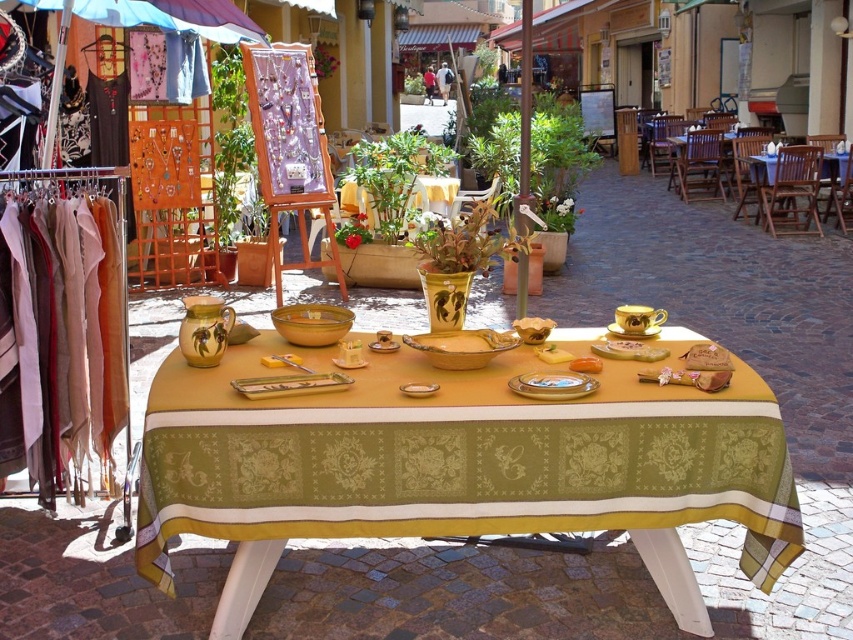
Can you confirm if yellow fabric table at center is positioned to the right of gold metallic platter at center?

In fact, yellow fabric table at center is to the left of gold metallic platter at center.

Can you confirm if yellow fabric table at center is positioned to the left of gold metallic platter at center?

Yes, yellow fabric table at center is to the left of gold metallic platter at center.

Between point (183, 490) and point (508, 380), which one is positioned in front?

Point (183, 490) is more forward.

The image size is (853, 640). Find the location of `yellow fabric table at center`. yellow fabric table at center is located at coordinates (457, 467).

Can you confirm if yellow fabric table at center is shorter than green damask tablecloth at left?

Correct, yellow fabric table at center is not as tall as green damask tablecloth at left.

Is yellow fabric table at center smaller than green damask tablecloth at left?

Actually, yellow fabric table at center might be larger than green damask tablecloth at left.

You are a GUI agent. You are given a task and a screenshot of the screen. Output one action in this format:
    pyautogui.click(x=<x>, y=<y>)
    Task: Click on the yellow fabric table at center
    
    Given the screenshot: What is the action you would take?
    pyautogui.click(x=457, y=467)

Does point (816, 145) lie behind point (590, 388)?

Yes, it is behind point (590, 388).

Which is in front, point (808, 202) or point (526, 376)?

Point (526, 376) is more forward.

Where is `wooden table at right`? The height and width of the screenshot is (640, 853). wooden table at right is located at coordinates (790, 189).